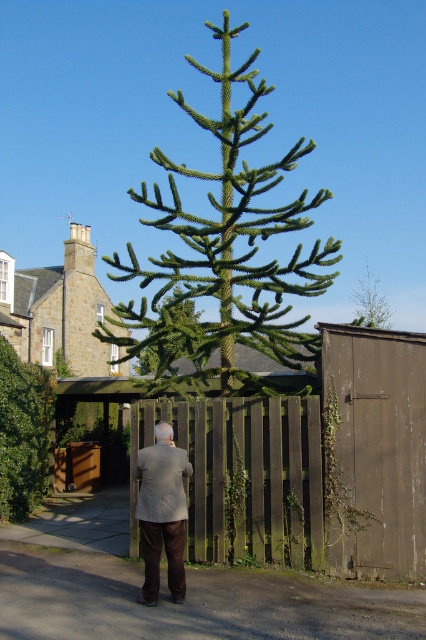
Can you confirm if gray wool coat at center is smaller than green leafy tree at upper center?

Indeed, gray wool coat at center has a smaller size compared to green leafy tree at upper center.

Which is in front, point (178, 541) or point (357, 280)?

Positioned in front is point (178, 541).

Between point (169, 572) and point (354, 294), which one is positioned in front?

Point (169, 572) is in front.

This screenshot has width=426, height=640. What are the coordinates of `gray wool coat at center` in the screenshot? It's located at (161, 513).

Does point (187, 529) come farther from viewer compared to point (357, 321)?

No, (187, 529) is in front of (357, 321).

Is point (317, 476) closer to camera compared to point (382, 321)?

Yes.

Who is more distant from viewer, (135, 529) or (357, 291)?

The point (357, 291) is more distant.

Image resolution: width=426 pixels, height=640 pixels. I want to click on green wooden fence at center, so click(247, 476).

Who is shorter, green leafy bush at lower left or gray wool coat at center?

gray wool coat at center

Does green leafy bush at lower left have a larger size compared to gray wool coat at center?

Yes.

Does point (8, 417) come in front of point (143, 595)?

No.

The width and height of the screenshot is (426, 640). Identify the location of green leafy bush at lower left. (23, 433).